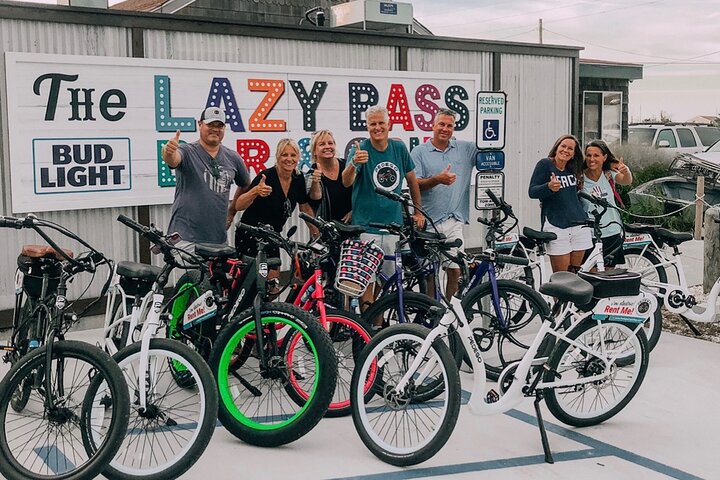
At what (x,y) coordinates should I click in order to perform the action: click on basket. Please return your answer as a coordinate pair (x, y). Looking at the image, I should click on (368, 264).